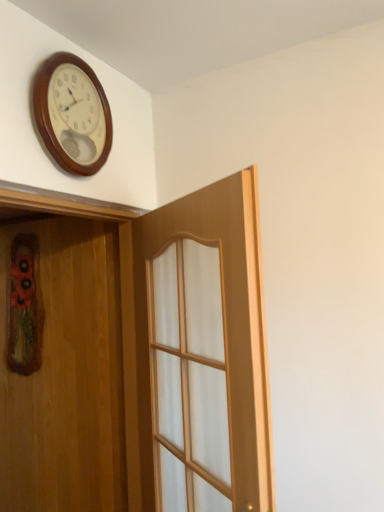
Question: Is light wood door at center, acting as the second door starting from the left, not within wooden door at left, the 1th door in the left-to-right sequence?

Choices:
 (A) yes
 (B) no

Answer: (A)

Question: Considering the relative positions of light wood door at center, which is counted as the first door, starting from the right, and wooden door at left, the 1th door in the left-to-right sequence, in the image provided, is light wood door at center, which is counted as the first door, starting from the right, to the left of wooden door at left, the 1th door in the left-to-right sequence, from the viewer's perspective?

Choices:
 (A) yes
 (B) no

Answer: (B)

Question: Can you confirm if light wood door at center, which is counted as the first door, starting from the right, is taller than wooden door at left, the 1th door in the left-to-right sequence?

Choices:
 (A) no
 (B) yes

Answer: (A)

Question: Considering the relative sizes of light wood door at center, acting as the second door starting from the left, and wooden door at left, placed as the 2th door when sorted from right to left, in the image provided, is light wood door at center, acting as the second door starting from the left, shorter than wooden door at left, placed as the 2th door when sorted from right to left,?

Choices:
 (A) no
 (B) yes

Answer: (B)

Question: Is light wood door at center, which is counted as the first door, starting from the right, closer to camera compared to wooden door at left, placed as the 2th door when sorted from right to left?

Choices:
 (A) yes
 (B) no

Answer: (A)

Question: Is light wood door at center, which is counted as the first door, starting from the right, aimed at wooden door at left, placed as the 2th door when sorted from right to left?

Choices:
 (A) no
 (B) yes

Answer: (B)

Question: From the image's perspective, is wooden door at left, the 1th door in the left-to-right sequence, beneath wooden wall clock at upper left?

Choices:
 (A) no
 (B) yes

Answer: (B)

Question: Can you confirm if wooden door at left, the 1th door in the left-to-right sequence, is smaller than wooden wall clock at upper left?

Choices:
 (A) yes
 (B) no

Answer: (B)

Question: Can we say wooden door at left, the 1th door in the left-to-right sequence, lies outside wooden wall clock at upper left?

Choices:
 (A) yes
 (B) no

Answer: (A)

Question: From a real-world perspective, does wooden door at left, placed as the 2th door when sorted from right to left, stand above wooden wall clock at upper left?

Choices:
 (A) yes
 (B) no

Answer: (B)

Question: From the image's perspective, is wooden door at left, placed as the 2th door when sorted from right to left, over wooden wall clock at upper left?

Choices:
 (A) yes
 (B) no

Answer: (B)

Question: Does wooden door at left, placed as the 2th door when sorted from right to left, lie behind wooden wall clock at upper left?

Choices:
 (A) yes
 (B) no

Answer: (B)

Question: From the image's perspective, is wooden door at left, the 1th door in the left-to-right sequence, over light wood door at center, acting as the second door starting from the left?

Choices:
 (A) no
 (B) yes

Answer: (A)